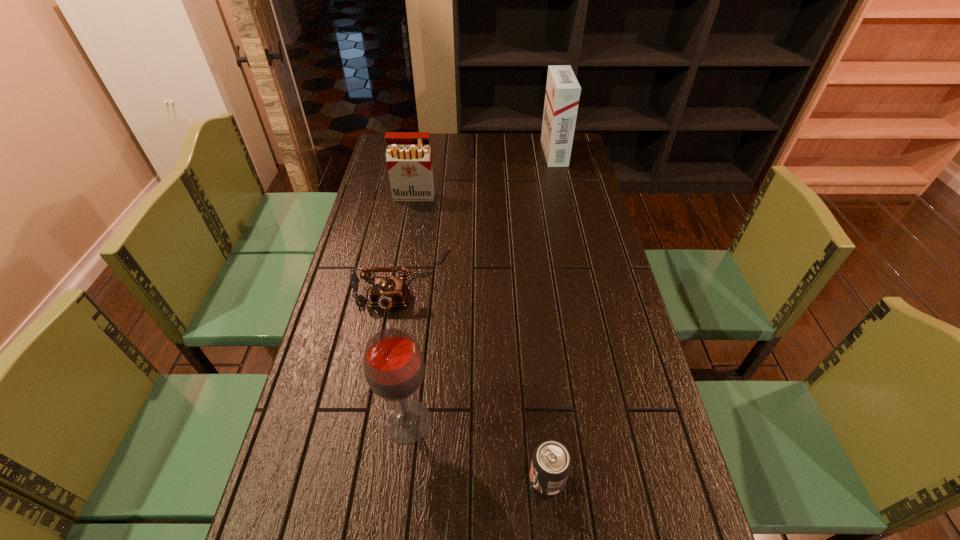
What are the coordinates of `the rightmost object` in the screenshot? It's located at (563, 90).

In order to click on the farthest object in this screenshot , I will do `click(563, 90)`.

Identify the location of the second nearest object. This screenshot has width=960, height=540. (393, 364).

Identify the location of the second farthest object. click(x=408, y=155).

Find the location of `the left cigarette case`. the left cigarette case is located at coordinates (408, 155).

At what (x,y) coordinates should I click in order to perform the action: click on telephone. Please return your answer as a coordinate pair (x, y). This screenshot has width=960, height=540. Looking at the image, I should click on (385, 292).

Find the location of a particular element. Image resolution: width=960 pixels, height=540 pixels. the second shortest object is located at coordinates (385, 292).

I want to click on the fourth object from left to right, so click(x=551, y=463).

Find the location of a particular element. soda can is located at coordinates (551, 463).

Locate an element on the screen. This screenshot has width=960, height=540. free region located on the left of the rightmost object is located at coordinates (458, 153).